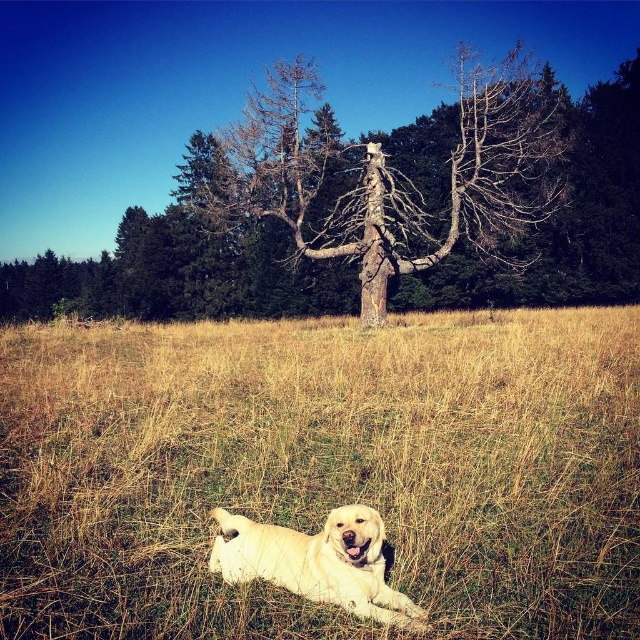
Question: Which point is farther to the camera?

Choices:
 (A) (100, 557)
 (B) (388, 262)

Answer: (B)

Question: Is golden grass at center to the right of bare wood tree at center from the viewer's perspective?

Choices:
 (A) no
 (B) yes

Answer: (A)

Question: Is bare wood tree at center smaller than golden fur dog at center?

Choices:
 (A) yes
 (B) no

Answer: (B)

Question: Which point appears farthest from the camera in this image?

Choices:
 (A) click(x=289, y=468)
 (B) click(x=224, y=572)
 (C) click(x=465, y=237)

Answer: (C)

Question: Among these points, which one is farthest from the camera?

Choices:
 (A) (515, 625)
 (B) (330, 564)

Answer: (B)

Question: Where is golden grass at center located in relation to bare wood tree at center in the image?

Choices:
 (A) left
 (B) right

Answer: (A)